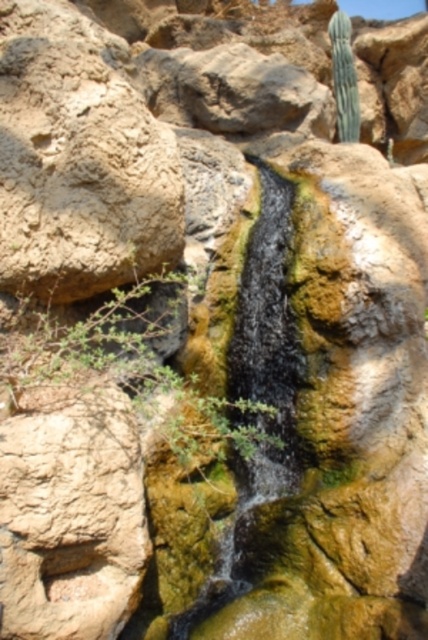
Question: Can you confirm if green leafy shrub at center is positioned to the right of green spiky cactus at upper right?

Choices:
 (A) no
 (B) yes

Answer: (A)

Question: Which of the following is the farthest from the observer?

Choices:
 (A) green leafy shrub at center
 (B) green spiky cactus at upper right

Answer: (B)

Question: Is green leafy shrub at center bigger than green spiky cactus at upper right?

Choices:
 (A) no
 (B) yes

Answer: (B)

Question: Does green leafy shrub at center appear on the left side of green spiky cactus at upper right?

Choices:
 (A) no
 (B) yes

Answer: (B)

Question: Which object is closer to the camera taking this photo?

Choices:
 (A) green leafy shrub at center
 (B) green spiky cactus at upper right

Answer: (A)